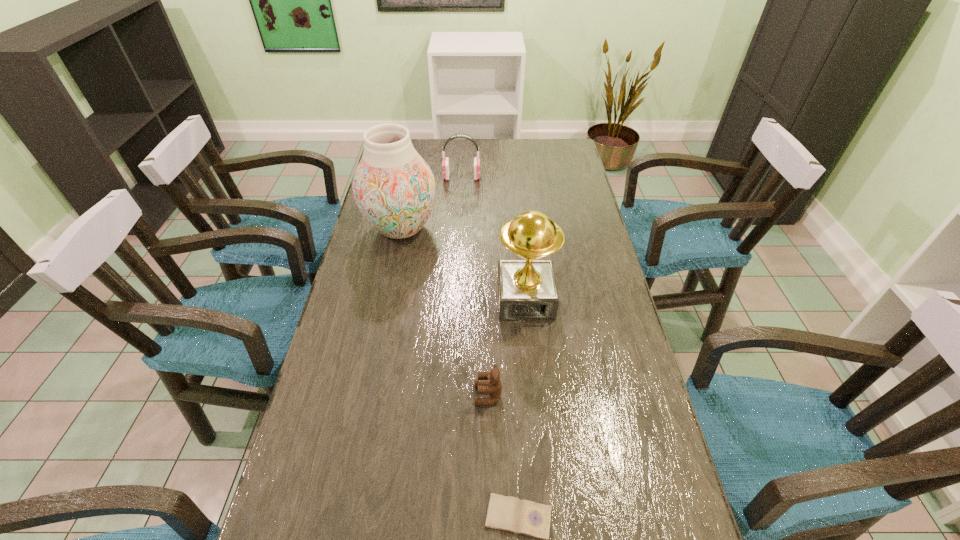
Where is `vacant space located 0.180m on the face of the second nearest object`? Image resolution: width=960 pixels, height=540 pixels. vacant space located 0.180m on the face of the second nearest object is located at coordinates (399, 395).

In order to click on free spot located 0.130m on the face of the second nearest object in this screenshot , I will do (x=420, y=395).

The height and width of the screenshot is (540, 960). I want to click on object that is at the left edge, so click(x=394, y=188).

Where is `vacant space at the far edge`? The height and width of the screenshot is (540, 960). vacant space at the far edge is located at coordinates (426, 147).

Identify the location of vacant space at the left edge of the desktop. point(364,373).

Where is `free space at the right edge of the desktop`? This screenshot has height=540, width=960. free space at the right edge of the desktop is located at coordinates (578, 285).

Find the location of a particular element. The width and height of the screenshot is (960, 540). vacant space at the far right corner is located at coordinates (541, 144).

At what (x,y) coordinates should I click in order to perform the action: click on free spot between the award and the teddy bear. Please return your answer as a coordinate pair (x, y). The image size is (960, 540). Looking at the image, I should click on click(x=507, y=347).

Find the location of `vacant area between the farthest object and the third farthest object`. vacant area between the farthest object and the third farthest object is located at coordinates (493, 238).

The width and height of the screenshot is (960, 540). What are the coordinates of `free spot between the fourth nearest object and the award` in the screenshot? It's located at (463, 264).